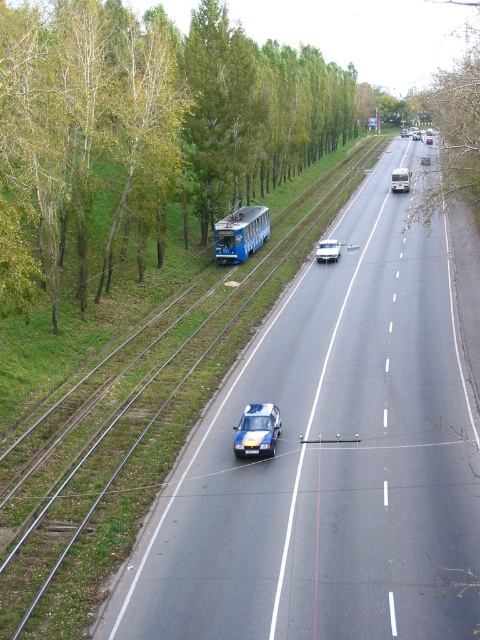
Question: Which object is the farthest from the green leafy tree at upper right?

Choices:
 (A) polished blue car at center
 (B) metallic blue police car at center
 (C) green leafy tree at upper left

Answer: (B)

Question: Does green leafy tree at upper right appear on the left side of polished blue car at center?

Choices:
 (A) yes
 (B) no

Answer: (B)

Question: Does smooth asphalt highway at center appear over green leafy tree at upper left?

Choices:
 (A) no
 (B) yes

Answer: (A)

Question: Which point appears closest to the camera in this image?

Choices:
 (A) (475, 172)
 (B) (336, 256)
 (C) (244, 609)
 (D) (408, 173)

Answer: (C)

Question: Which point is closer to the camera taking this photo?

Choices:
 (A) (229, 257)
 (B) (269, 410)

Answer: (B)

Question: Does green leafy tree at upper right have a greater width compared to metallic blue police car at center?

Choices:
 (A) no
 (B) yes

Answer: (B)